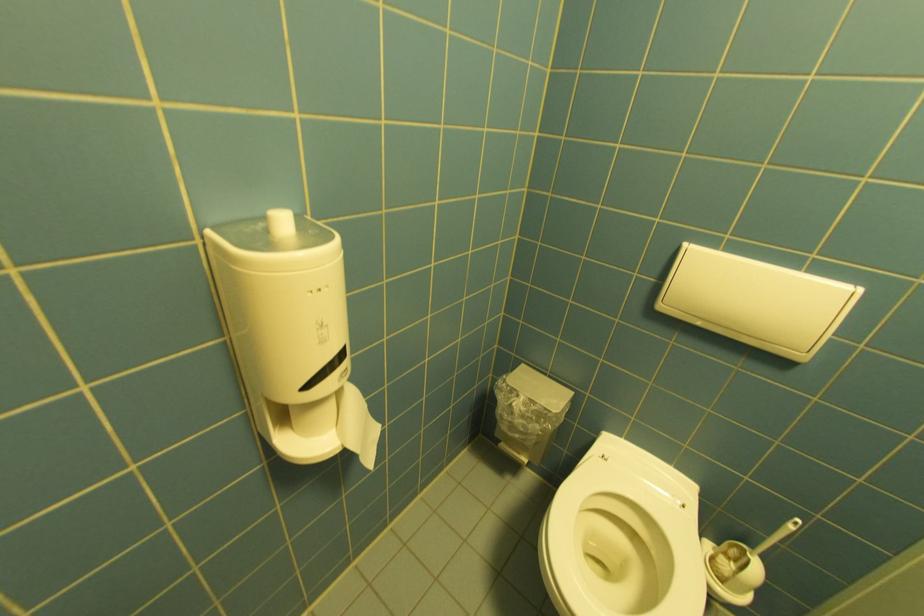
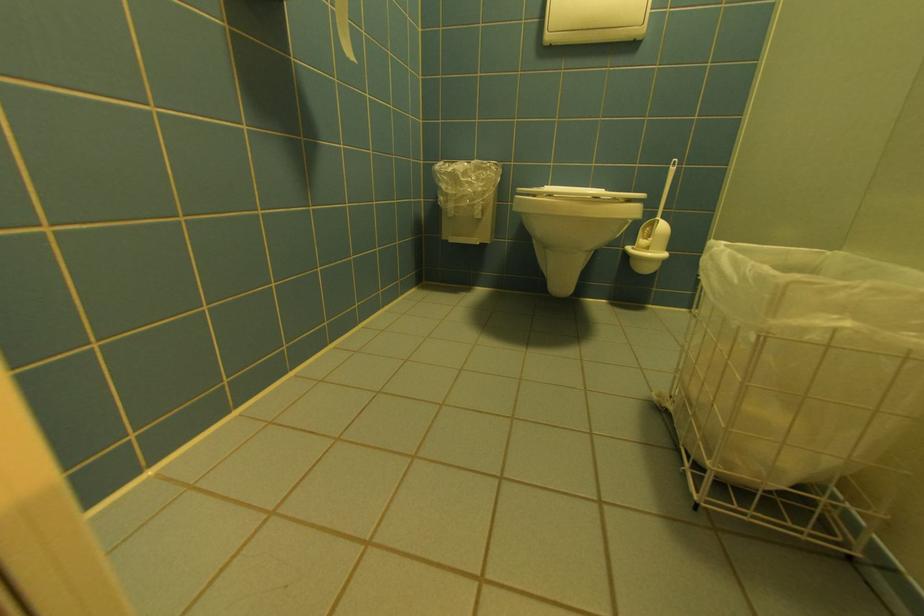
Question: The first image is from the beginning of the video and the second image is from the end. How did the camera likely rotate when shooting the video?

Choices:
 (A) Left
 (B) Right
 (C) Up
 (D) Down

Answer: (B)